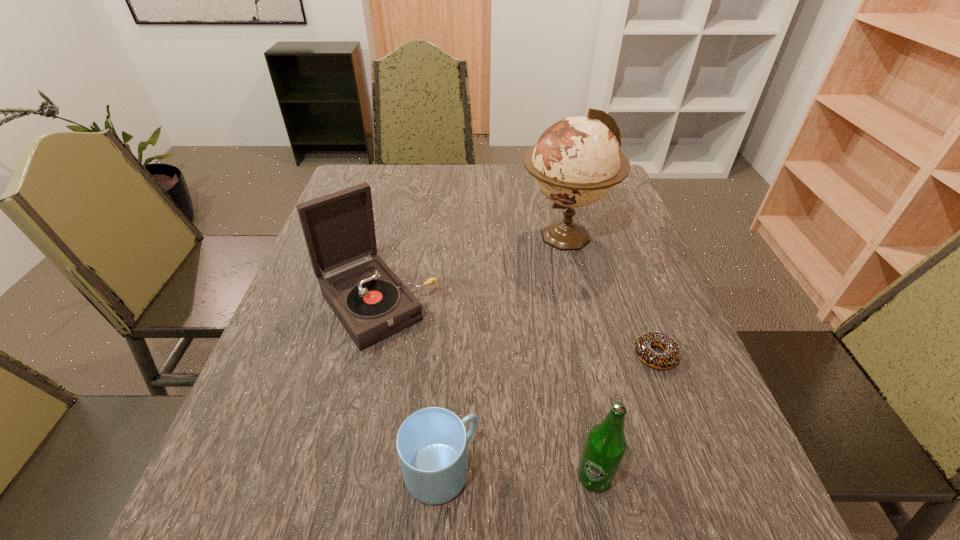
Identify the location of vacant space located 0.100m on the back of the fourth tallest object. (446, 391).

The width and height of the screenshot is (960, 540). What are the coordinates of `free region located on the back of the doughnut` in the screenshot? It's located at (614, 242).

The width and height of the screenshot is (960, 540). Find the location of `beer bottle positioned at the near edge`. beer bottle positioned at the near edge is located at coordinates (605, 446).

Identify the location of mug that is at the near edge. The image size is (960, 540). [431, 443].

You are a GUI agent. You are given a task and a screenshot of the screen. Output one action in this format:
    pyautogui.click(x=<x>, y=<y>)
    Task: Click on the object that is at the left edge
    
    Given the screenshot: What is the action you would take?
    pyautogui.click(x=372, y=303)

Find the location of a particular element. This screenshot has height=540, width=960. globe situated at the right edge is located at coordinates (576, 161).

The image size is (960, 540). What are the coordinates of `doughnut located in the right edge section of the desktop` in the screenshot? It's located at (670, 358).

In the image, there is a desktop. Where is `free region at the far edge`? This screenshot has width=960, height=540. free region at the far edge is located at coordinates (477, 197).

In the image, there is a desktop. What are the coordinates of `free space at the near edge` in the screenshot? It's located at (340, 522).

Where is `vacant region at the left edge`? The height and width of the screenshot is (540, 960). vacant region at the left edge is located at coordinates (274, 337).